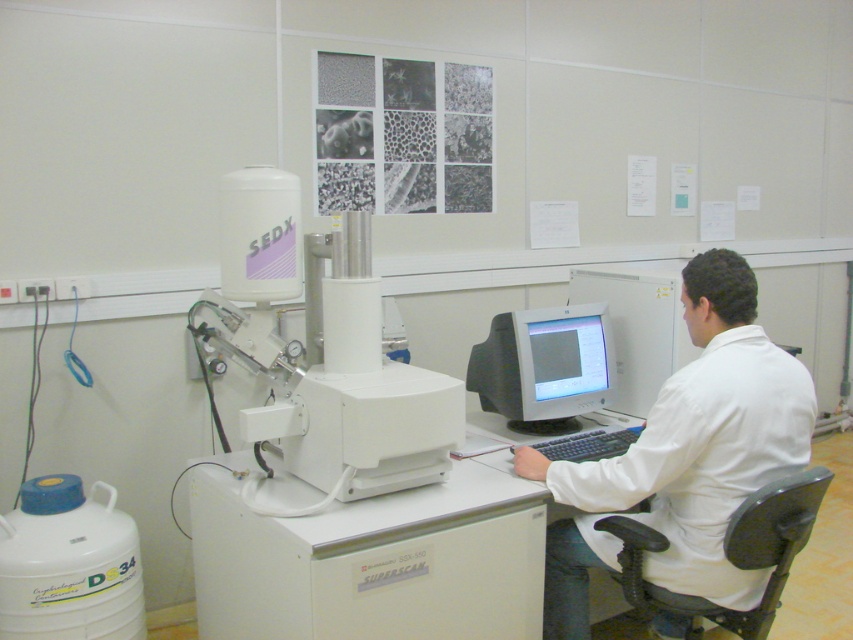
Question: Can you confirm if white lab coat at center is positioned to the right of matte gray monitor at center?

Choices:
 (A) yes
 (B) no

Answer: (A)

Question: Does white plastic table at center appear on the left side of matte gray monitor at center?

Choices:
 (A) yes
 (B) no

Answer: (A)

Question: Which of the following is the farthest from the observer?

Choices:
 (A) white lab coat at center
 (B) matte gray monitor at center
 (C) white plastic table at center

Answer: (B)

Question: Which is nearer to the matte gray monitor at center?

Choices:
 (A) white plastic table at center
 (B) white lab coat at center

Answer: (B)

Question: Which of the following is the farthest from the observer?

Choices:
 (A) (587, 348)
 (B) (680, 545)

Answer: (A)

Question: Does white plastic table at center have a greater width compared to matte gray monitor at center?

Choices:
 (A) yes
 (B) no

Answer: (A)